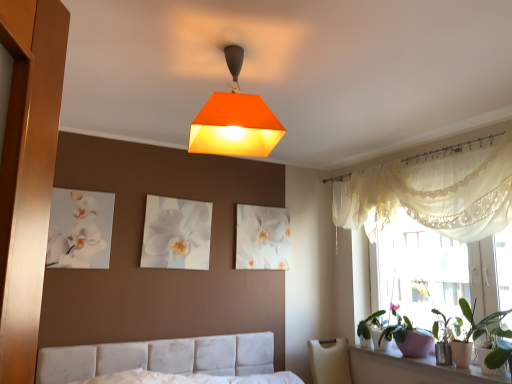
Question: Is green matte plant at right further to the viewer compared to white glossy canvas at upper left, the third picture frame from the back?

Choices:
 (A) yes
 (B) no

Answer: (B)

Question: From the image's perspective, is green matte plant at right located beneath white glossy canvas at upper left, the third picture frame from the back?

Choices:
 (A) no
 (B) yes

Answer: (B)

Question: From a real-world perspective, is green matte plant at right on white glossy canvas at upper left, which is counted as the first picture frame, starting from the left?

Choices:
 (A) yes
 (B) no

Answer: (B)

Question: Does green matte plant at right have a greater height compared to white glossy canvas at upper left, the third picture frame from the back?

Choices:
 (A) no
 (B) yes

Answer: (A)

Question: Does green matte plant at right have a larger size compared to white glossy canvas at upper left, which is counted as the first picture frame, starting from the left?

Choices:
 (A) yes
 (B) no

Answer: (A)

Question: Would you say white ceramic window sill at lower right is to the left or to the right of white glossy picture frame at center, the first picture frame positioned from the back, in the picture?

Choices:
 (A) right
 (B) left

Answer: (A)

Question: Considering the positions of white ceramic window sill at lower right and white glossy picture frame at center, the third picture frame from the left, in the image, is white ceramic window sill at lower right wider or thinner than white glossy picture frame at center, the third picture frame from the left,?

Choices:
 (A) wide
 (B) thin

Answer: (A)

Question: In the image, is white ceramic window sill at lower right positioned in front of or behind white glossy picture frame at center, the third picture frame in the front-to-back sequence?

Choices:
 (A) behind
 (B) front

Answer: (B)

Question: From a real-world perspective, is white ceramic window sill at lower right physically located above or below white glossy picture frame at center, the third picture frame in the front-to-back sequence?

Choices:
 (A) above
 (B) below

Answer: (B)

Question: Is white lace curtain at upper right to the left or to the right of green matte plant at right in the image?

Choices:
 (A) right
 (B) left

Answer: (B)

Question: Considering the positions of white lace curtain at upper right and green matte plant at right in the image, is white lace curtain at upper right taller or shorter than green matte plant at right?

Choices:
 (A) tall
 (B) short

Answer: (A)

Question: Is white lace curtain at upper right in front of or behind green matte plant at right in the image?

Choices:
 (A) behind
 (B) front

Answer: (B)

Question: From a real-world perspective, is white lace curtain at upper right above or below green matte plant at right?

Choices:
 (A) above
 (B) below

Answer: (A)

Question: Would you say green matte plant at right is to the left or to the right of orange matte lampshade at upper center in the picture?

Choices:
 (A) right
 (B) left

Answer: (A)

Question: From the image's perspective, is green matte plant at right positioned above or below orange matte lampshade at upper center?

Choices:
 (A) above
 (B) below

Answer: (B)